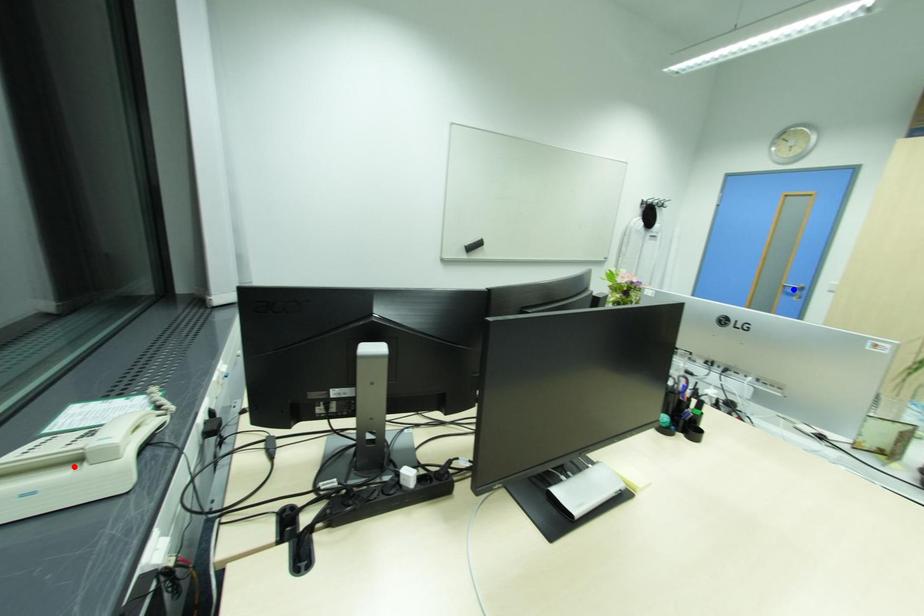
Question: Two points are marked on the image. Which point is closer to the camera?

Choices:
 (A) Blue point is closer.
 (B) Red point is closer.

Answer: (B)